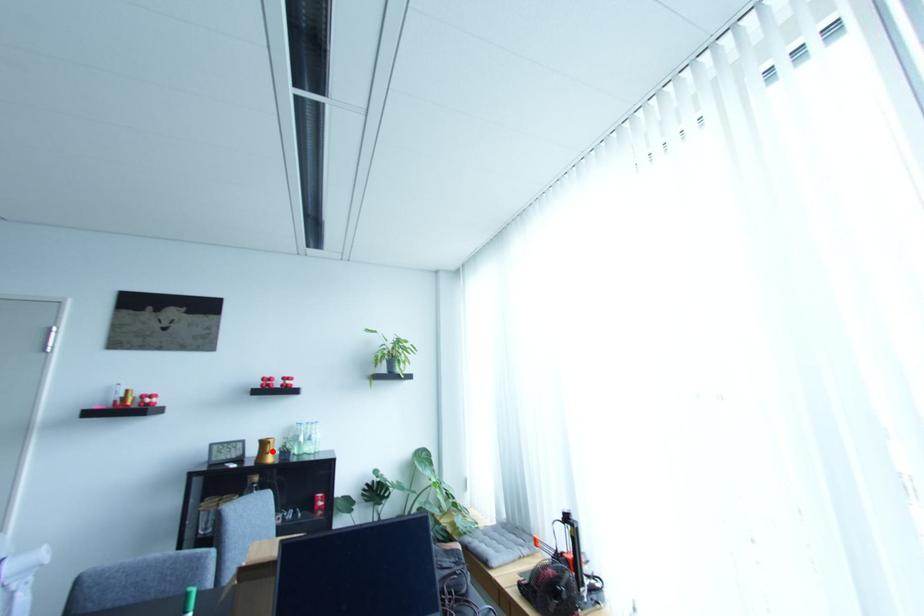
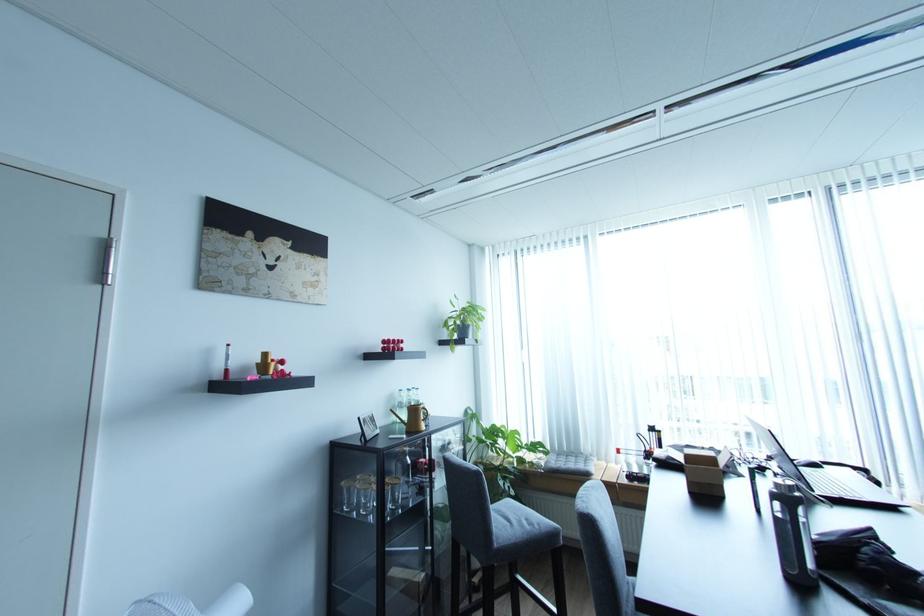
Where in the second image is the point corresponding to the highlighted location from the first image?

(426, 418)